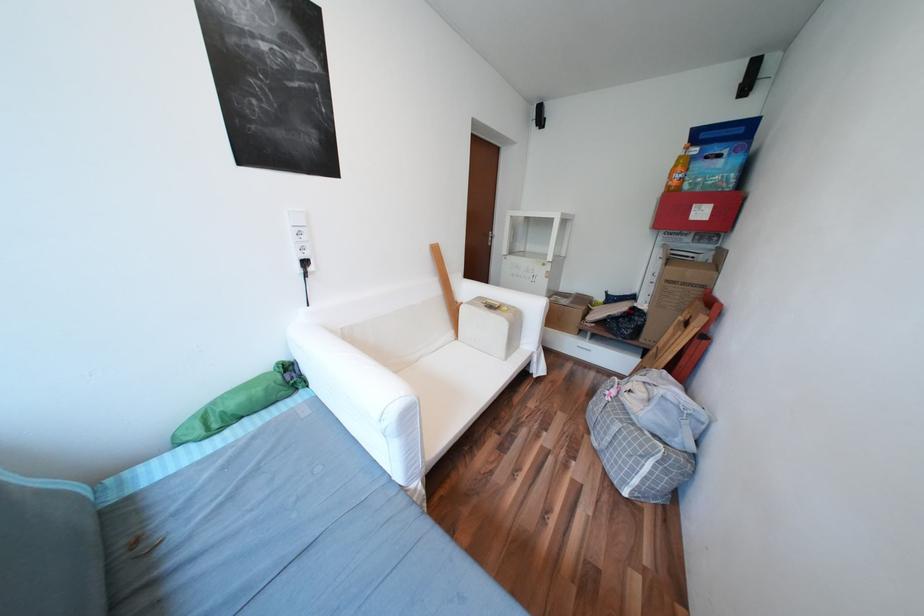
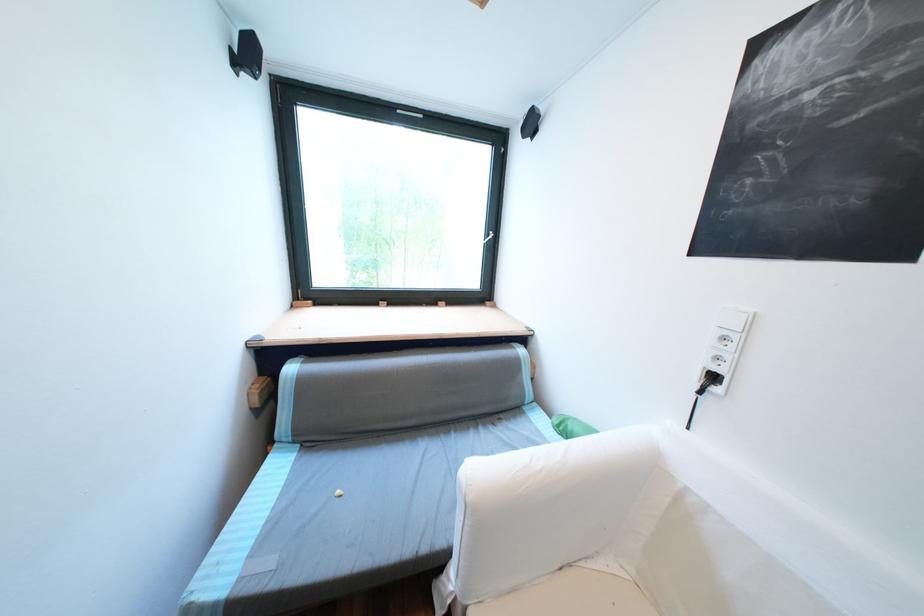
Locate, in the second image, the point that corresponds to point (314, 262) in the first image.

(723, 378)